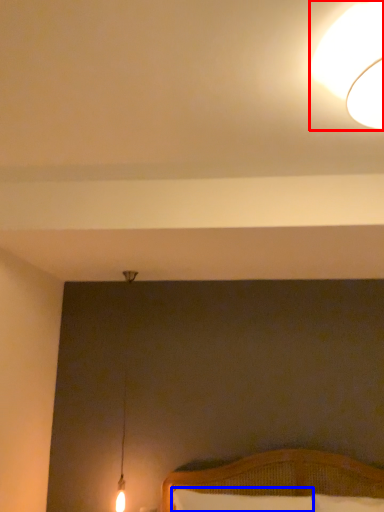
Question: Which point is further to the camera, lamp (highlighted by a red box) or pillow (highlighted by a blue box)?

Choices:
 (A) lamp
 (B) pillow

Answer: (B)